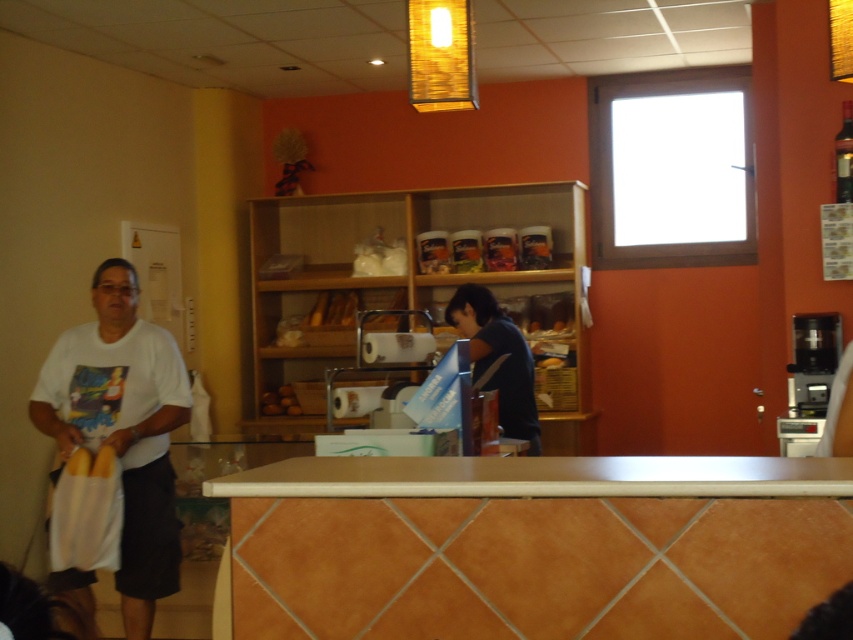
How far apart are smooth beige counter at center and light brown wood counter top at center?

smooth beige counter at center is 2.62 inches from light brown wood counter top at center.

Describe the element at coordinates (534, 545) in the screenshot. I see `smooth beige counter at center` at that location.

Identify the location of smooth beige counter at center. Image resolution: width=853 pixels, height=640 pixels. (534, 545).

The width and height of the screenshot is (853, 640). I want to click on smooth beige counter at center, so click(x=534, y=545).

Can you confirm if white cotton shirt at left is positioned above dark blue shirt at center?

No.

Locate an element on the screen. This screenshot has width=853, height=640. white cotton shirt at left is located at coordinates (123, 428).

Does light brown wood counter top at center appear over dark blue shirt at center?

No.

Is light brown wood counter top at center taller than dark blue shirt at center?

No.

Does point (390, 488) come farther from viewer compared to point (474, 285)?

No, it is not.

The image size is (853, 640). What are the coordinates of `light brown wood counter top at center` in the screenshot? It's located at (540, 477).